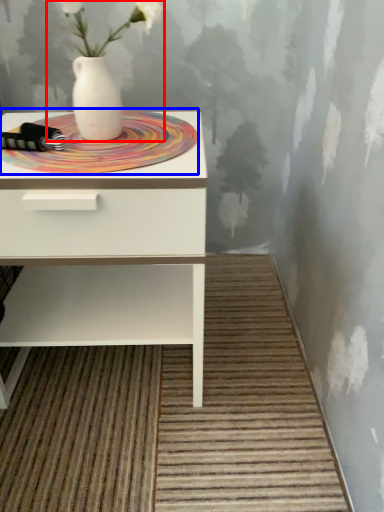
Question: Which of the following is the closest to the observer, floral arrangement (highlighted by a red box) or mat (highlighted by a blue box)?

Choices:
 (A) floral arrangement
 (B) mat

Answer: (A)